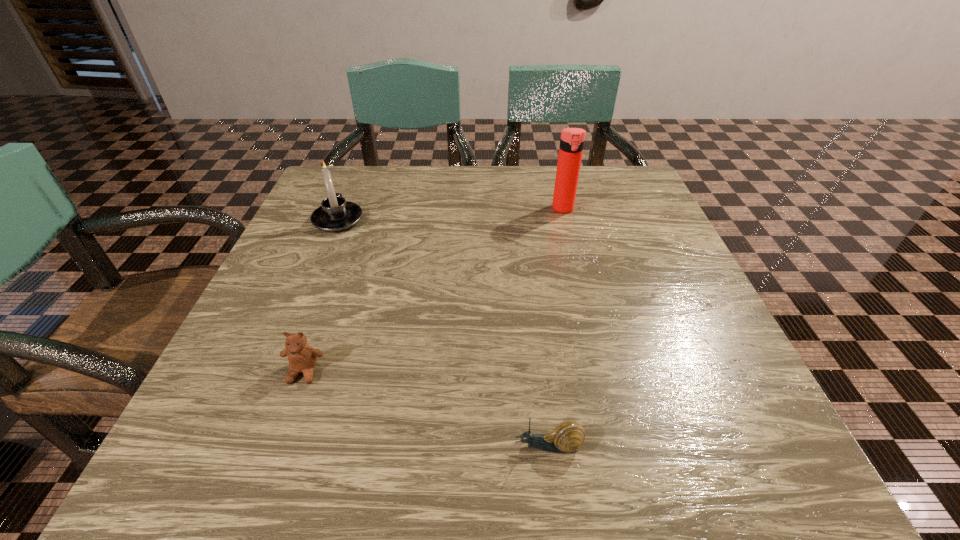
I want to click on blank area at the far edge, so click(461, 209).

Find the location of a particular element. Image resolution: width=960 pixels, height=540 pixels. vacant space at the near edge of the desktop is located at coordinates (514, 436).

Where is `vacant position at the right edge of the desktop`? The image size is (960, 540). vacant position at the right edge of the desktop is located at coordinates (666, 267).

This screenshot has width=960, height=540. What are the coordinates of `vacant position at the far left corner of the desktop` in the screenshot? It's located at (352, 194).

The height and width of the screenshot is (540, 960). In order to click on free space at the far right corner of the desktop in this screenshot , I will do `click(604, 205)`.

This screenshot has height=540, width=960. What are the coordinates of `empty space between the tallest object and the teddy bear` in the screenshot? It's located at (434, 291).

Where is `free space between the shortest object and the thermos bottle`? Image resolution: width=960 pixels, height=540 pixels. free space between the shortest object and the thermos bottle is located at coordinates (556, 328).

Where is `empty space that is in between the rightmost object and the second nearest object`? The height and width of the screenshot is (540, 960). empty space that is in between the rightmost object and the second nearest object is located at coordinates (434, 291).

Identify the location of empty space between the candle holder and the second shortest object. (321, 296).

Find the location of a particular element. The width and height of the screenshot is (960, 540). free point between the teddy bear and the rightmost object is located at coordinates (434, 291).